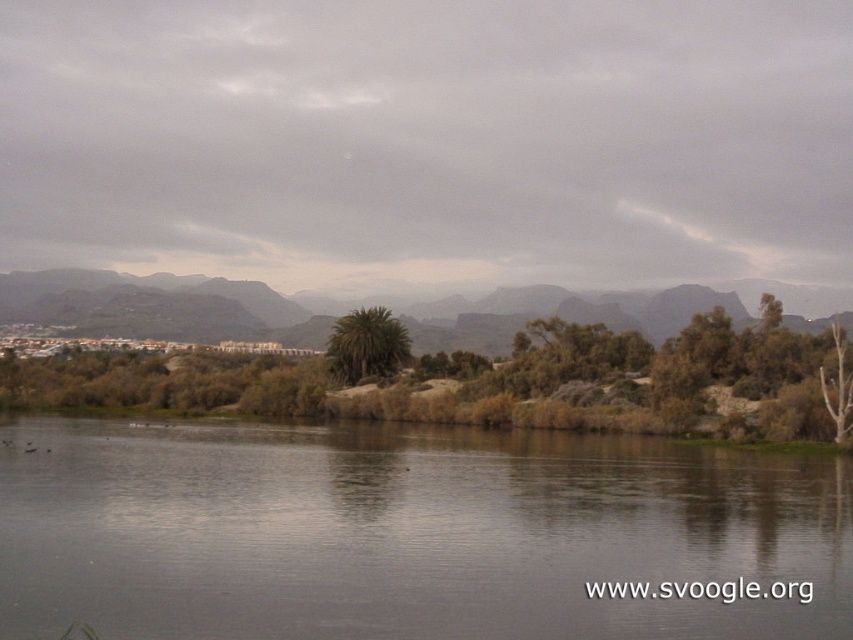
Measure the distance between point (152, 531) and camera.

Point (152, 531) and camera are 28.97 meters apart from each other.

Is gray reflective water at center closer to camera compared to green leafy vegetation at lower center?

Yes, gray reflective water at center is closer to the viewer.

Image resolution: width=853 pixels, height=640 pixels. Describe the element at coordinates (405, 532) in the screenshot. I see `gray reflective water at center` at that location.

Find the location of a particular element. gray reflective water at center is located at coordinates (405, 532).

Does green leafy tree at center have a greater height compared to green leafy palm tree at center?

Correct, green leafy tree at center is much taller as green leafy palm tree at center.

Which is above, green leafy tree at center or green leafy palm tree at center?

green leafy palm tree at center is above.

Identify the location of green leafy tree at center. (483, 380).

Does gray reflective water at center lie in front of green leafy palm tree at center?

Yes, it is in front of green leafy palm tree at center.

Is the position of gray reflective water at center more distant than that of green leafy palm tree at center?

That is False.

The width and height of the screenshot is (853, 640). What do you see at coordinates (405, 532) in the screenshot?
I see `gray reflective water at center` at bounding box center [405, 532].

At what (x,y) coordinates should I click in order to perform the action: click on gray reflective water at center. Please return your answer as a coordinate pair (x, y). The image size is (853, 640). Looking at the image, I should click on (405, 532).